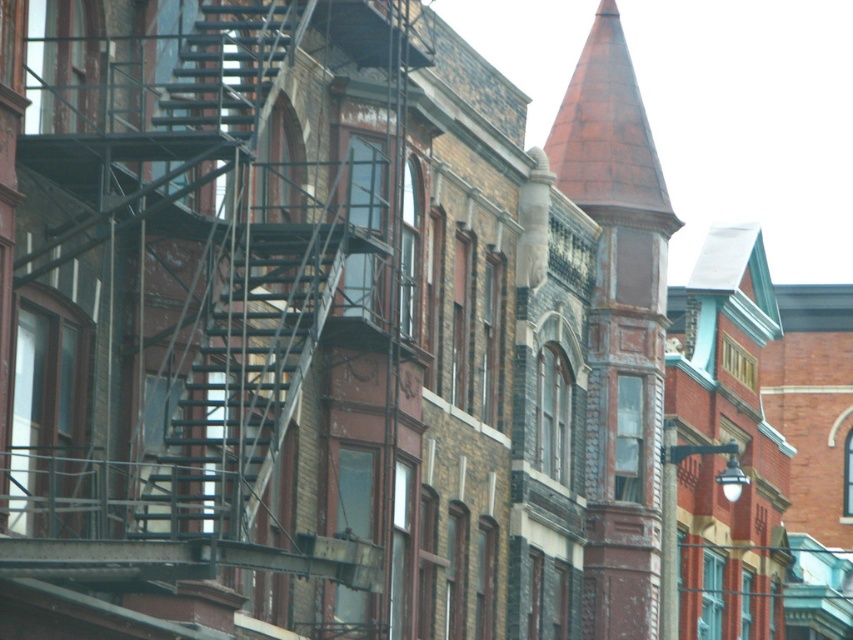
Does point (10, 589) come closer to viewer compared to point (599, 464)?

Yes, it is in front of point (599, 464).

Does metallic fire escape at left appear on the left side of rusty metal spire at center?

Correct, you'll find metallic fire escape at left to the left of rusty metal spire at center.

Between point (355, 262) and point (651, 330), which one is positioned behind?

The point (651, 330) is behind.

Identify the location of metallic fire escape at left. (200, 308).

Can you confirm if metallic fire escape at left is smaller than metallic fire escape at center?

Actually, metallic fire escape at left might be larger than metallic fire escape at center.

Is metallic fire escape at left shorter than metallic fire escape at center?

No.

Is point (395, 410) positioned after point (271, 243)?

Yes, point (395, 410) is farther from viewer.

Where is `metallic fire escape at left`? metallic fire escape at left is located at coordinates (200, 308).

Does rusty metal spire at center come behind metallic fire escape at center?

Yes, it is.

Is point (621, 218) positioned in front of point (283, 332)?

No, it is not.

Is point (639, 380) closer to viewer compared to point (224, 378)?

No, it is not.

The width and height of the screenshot is (853, 640). I want to click on rusty metal spire at center, so point(618,328).